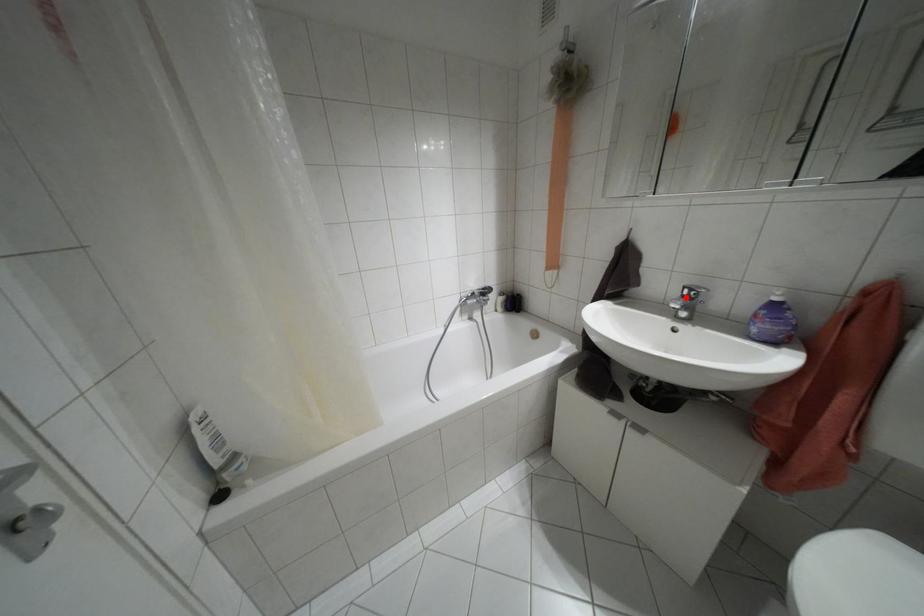
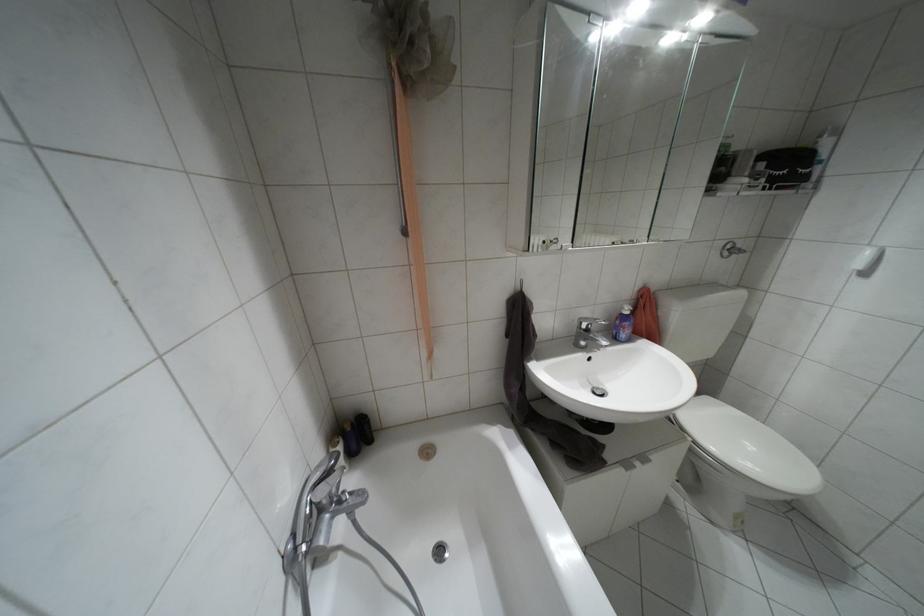
In the second image, find the point that corresponds to the highlighted location in the first image.

(587, 330)